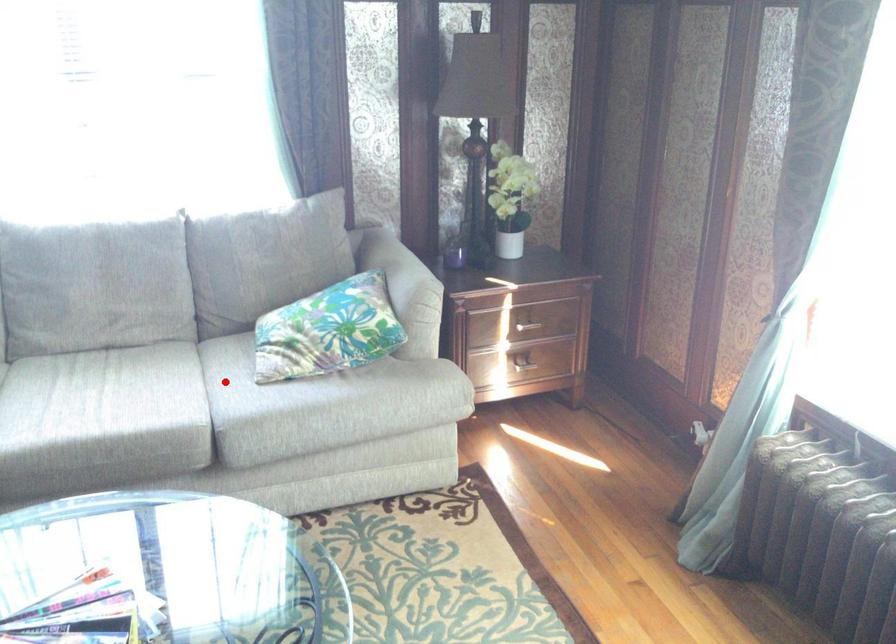
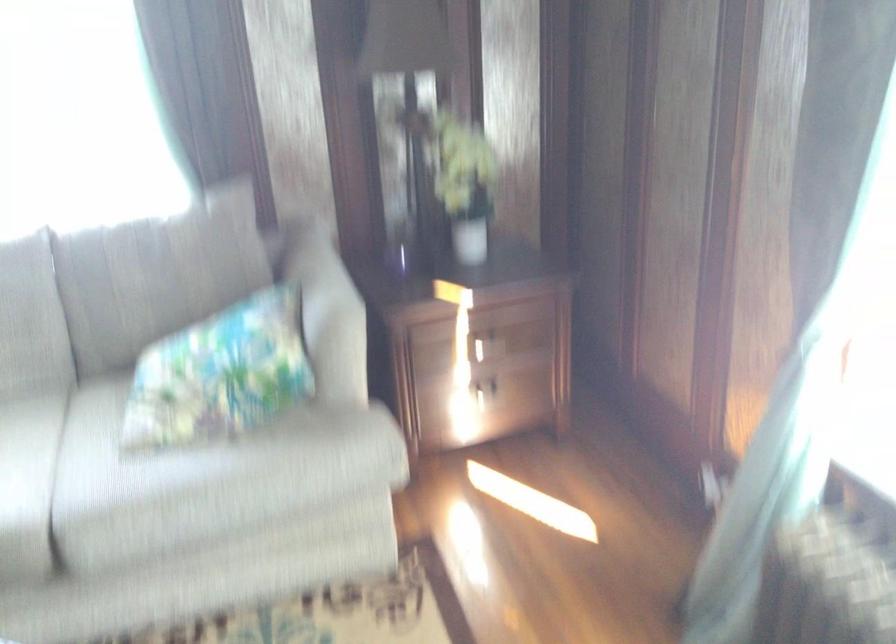
Question: I am providing you with two images of the same scene from different viewpoints. Image1 has a red point marked. In image2, the corresponding 3D location appears at what relative position? Reply with the corresponding letter.

Choices:
 (A) Closer
 (B) Farther

Answer: (A)